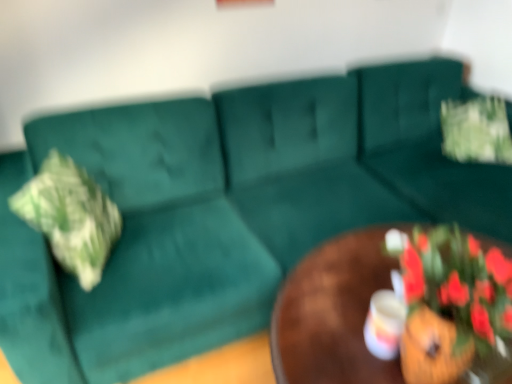
Question: Is matte white coffee cup at center at the left side of brown wooden table at center?

Choices:
 (A) no
 (B) yes

Answer: (B)

Question: Is matte white coffee cup at center positioned before brown wooden table at center?

Choices:
 (A) no
 (B) yes

Answer: (A)

Question: From a real-world perspective, is matte white coffee cup at center located beneath brown wooden table at center?

Choices:
 (A) no
 (B) yes

Answer: (A)

Question: Can you confirm if matte white coffee cup at center is wider than brown wooden table at center?

Choices:
 (A) no
 (B) yes

Answer: (A)

Question: Is matte white coffee cup at center not inside brown wooden table at center?

Choices:
 (A) yes
 (B) no

Answer: (B)

Question: Is matte white coffee cup at center facing towards brown wooden table at center?

Choices:
 (A) yes
 (B) no

Answer: (B)

Question: Does matte white coffee cup at center lie behind green fabric flower at upper right?

Choices:
 (A) yes
 (B) no

Answer: (B)

Question: Is green fabric flower at upper right at the back of matte white coffee cup at center?

Choices:
 (A) no
 (B) yes

Answer: (A)

Question: Is matte white coffee cup at center taller than green fabric flower at upper right?

Choices:
 (A) no
 (B) yes

Answer: (A)

Question: Is matte white coffee cup at center not within green fabric flower at upper right?

Choices:
 (A) no
 (B) yes

Answer: (B)

Question: Does matte white coffee cup at center have a greater width compared to green fabric flower at upper right?

Choices:
 (A) no
 (B) yes

Answer: (A)

Question: Is matte white coffee cup at center beside green fabric flower at upper right?

Choices:
 (A) yes
 (B) no

Answer: (B)

Question: Considering the relative positions of matte white coffee cup at center and green textured pillow at left in the image provided, is matte white coffee cup at center to the left of green textured pillow at left from the viewer's perspective?

Choices:
 (A) yes
 (B) no

Answer: (B)